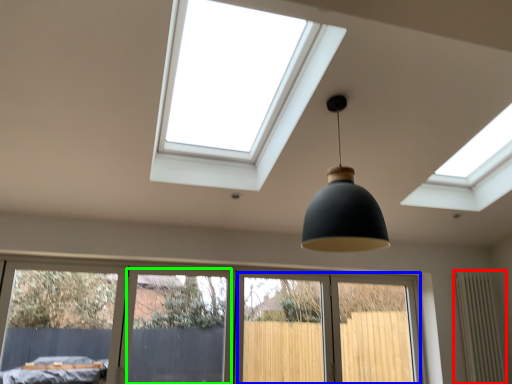
Question: Which is farther away from radiator (highlighted by a red box)? screen door (highlighted by a blue box) or screen door (highlighted by a green box)?

Choices:
 (A) screen door
 (B) screen door

Answer: (B)